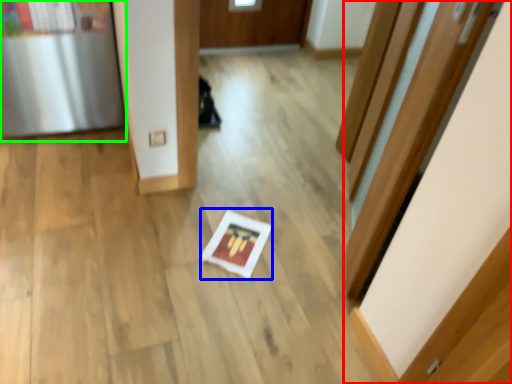
Question: Considering the real-world distances, which object is closest to door (highlighted by a red box)? copy (highlighted by a blue box) or fridge (highlighted by a green box).

Choices:
 (A) copy
 (B) fridge

Answer: (A)